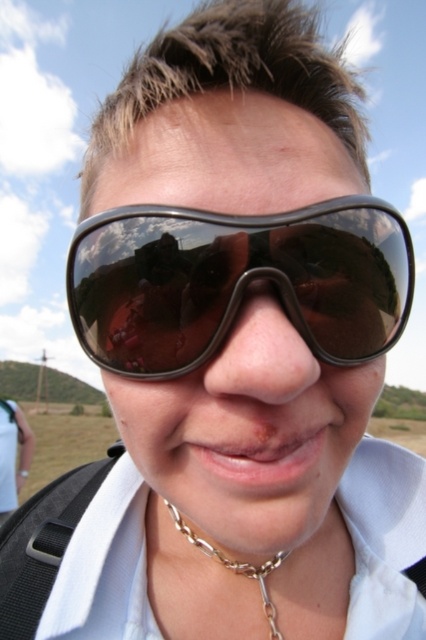
Question: Does black matte goggles at center come in front of gold chain necklace at lower center?

Choices:
 (A) no
 (B) yes

Answer: (B)

Question: Does black matte goggles at center appear on the right side of gold chain necklace at lower center?

Choices:
 (A) no
 (B) yes

Answer: (B)

Question: Is black matte goggles at center closer to camera compared to gold chain necklace at lower center?

Choices:
 (A) no
 (B) yes

Answer: (B)